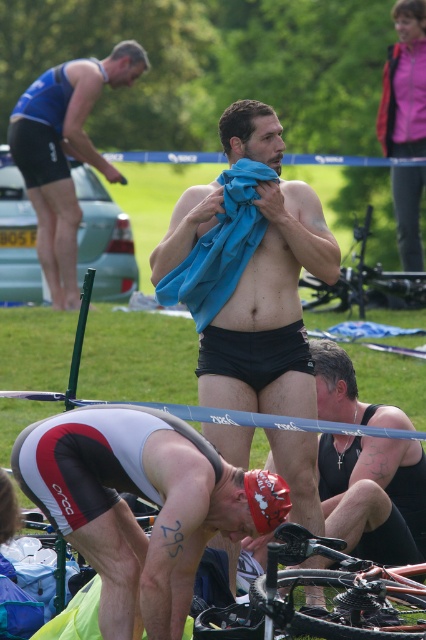
Question: Which object is closer to the camera taking this photo?

Choices:
 (A) white matte cycling shorts at lower left
 (B) black matte shorts at center
 (C) matte blue shorts at upper left

Answer: (A)

Question: In this image, where is pink fabric jacket at upper right located relative to red matte bicycle helmet at lower center?

Choices:
 (A) left
 (B) right

Answer: (B)

Question: Which point is closer to the camera?

Choices:
 (A) pink fabric jacket at upper right
 (B) matte blue shorts at upper left

Answer: (B)

Question: Which is farther from the pink fabric jacket at upper right?

Choices:
 (A) red matte bicycle helmet at lower center
 (B) matte blue shorts at upper left

Answer: (A)

Question: Is black matte shorts at center thinner than matte blue shorts at upper left?

Choices:
 (A) yes
 (B) no

Answer: (A)

Question: Considering the relative positions of pink fabric jacket at upper right and red matte bicycle helmet at lower center in the image provided, where is pink fabric jacket at upper right located with respect to red matte bicycle helmet at lower center?

Choices:
 (A) right
 (B) left

Answer: (A)